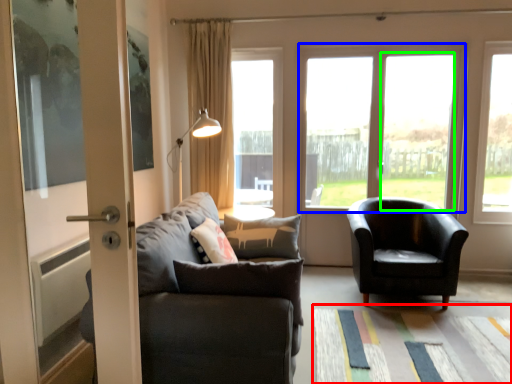
Question: Which object is the farthest from mat (highlighted by a red box)? Choose among these: window (highlighted by a blue box) or window frame (highlighted by a green box).

Choices:
 (A) window
 (B) window frame

Answer: (B)